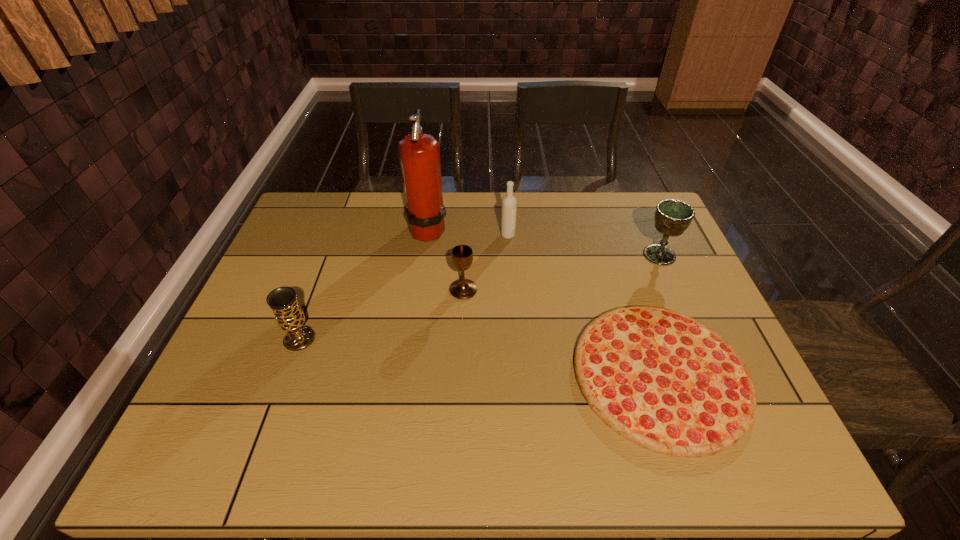
I want to click on vacant space located on the front of the vodka, so click(511, 276).

The image size is (960, 540). What are the coordinates of `vacant position located 0.050m on the left of the farthest chalice` in the screenshot? It's located at (625, 255).

Locate an element on the screen. The width and height of the screenshot is (960, 540). free region located 0.120m on the back of the nearest chalice is located at coordinates (317, 292).

Identify the location of vacant region located on the front of the third object from left to right. This screenshot has height=540, width=960. (462, 326).

At what (x,y) coordinates should I click in order to perform the action: click on vacant area situated on the left of the shortest object. Please return your answer as a coordinate pair (x, y). Looking at the image, I should click on (434, 374).

The height and width of the screenshot is (540, 960). I want to click on fire extinguisher at the far edge, so click(x=419, y=153).

The image size is (960, 540). Find the location of `vodka situated at the far edge`. vodka situated at the far edge is located at coordinates (509, 203).

Where is `object that is at the near edge`? The width and height of the screenshot is (960, 540). object that is at the near edge is located at coordinates (663, 380).

The height and width of the screenshot is (540, 960). Identify the location of object that is at the left edge. (289, 316).

You are a GUI agent. You are given a task and a screenshot of the screen. Output one action in this format:
    pyautogui.click(x=<x>, y=<y>)
    Task: Click on the chalice situated at the right edge
    
    Given the screenshot: What is the action you would take?
    pyautogui.click(x=672, y=217)